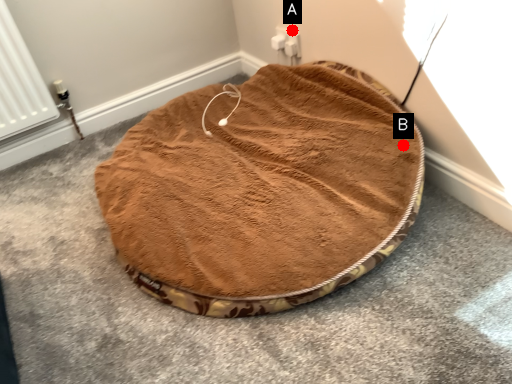
Question: Two points are circled on the image, labeled by A and B beside each circle. Which point is farther from the camera taking this photo?

Choices:
 (A) A is further
 (B) B is further

Answer: (A)